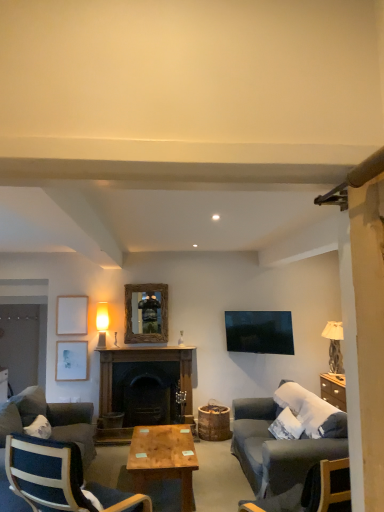
Describe the element at coordinates (102, 322) in the screenshot. I see `matte white lampshade at upper left, the first lamp in the left-to-right sequence` at that location.

Where is `dark gray fabric couch at lower left, acting as the second studio couch starting from the front`? Image resolution: width=384 pixels, height=512 pixels. dark gray fabric couch at lower left, acting as the second studio couch starting from the front is located at coordinates (49, 421).

What is the approximate height of wooden mirror at center, which is the first picture frame from right to left?

wooden mirror at center, which is the first picture frame from right to left, is 32.30 inches tall.

The width and height of the screenshot is (384, 512). What do you see at coordinates (163, 458) in the screenshot? I see `wooden polished coffee table at center` at bounding box center [163, 458].

The height and width of the screenshot is (512, 384). What do you see at coordinates (71, 361) in the screenshot? I see `matte white picture frame at left, which is the 2th picture frame in left-to-right order` at bounding box center [71, 361].

Find the location of `matte white lampshade at upper left, the first lamp in the left-to-right sequence`. matte white lampshade at upper left, the first lamp in the left-to-right sequence is located at coordinates (x=102, y=322).

Considering the relative sizes of white fabric lampshade at right, which is the 1th lamp from right to left, and dark gray fabric couch at lower right, placed as the 1th studio couch when sorted from right to left, in the image provided, is white fabric lampshade at right, which is the 1th lamp from right to left, taller than dark gray fabric couch at lower right, placed as the 1th studio couch when sorted from right to left,?

No, white fabric lampshade at right, which is the 1th lamp from right to left, is not taller than dark gray fabric couch at lower right, placed as the 1th studio couch when sorted from right to left.

Which is more to the right, white fabric lampshade at right, the second lamp in the left-to-right sequence, or dark gray fabric couch at lower right, positioned as the 2th studio couch in back-to-front order?

white fabric lampshade at right, the second lamp in the left-to-right sequence.

Is white fabric lampshade at right, which is the 1th lamp from right to left, placed right next to dark gray fabric couch at lower right, which is counted as the first studio couch, starting from the front?

No, white fabric lampshade at right, which is the 1th lamp from right to left, is not touching dark gray fabric couch at lower right, which is counted as the first studio couch, starting from the front.

Can you confirm if wooden polished coffee table at center is bigger than matte white lampshade at upper left, the first lamp in the left-to-right sequence?

Yes, wooden polished coffee table at center is bigger than matte white lampshade at upper left, the first lamp in the left-to-right sequence.

Is wooden polished coffee table at center not near matte white lampshade at upper left, the first lamp in the left-to-right sequence?

Absolutely, wooden polished coffee table at center is distant from matte white lampshade at upper left, the first lamp in the left-to-right sequence.

From the picture: Who is shorter, wooden polished coffee table at center or matte white lampshade at upper left, the first lamp in the left-to-right sequence?

Standing shorter between the two is wooden polished coffee table at center.

From a real-world perspective, between wooden mirror at center, the third picture frame when ordered from left to right, and dark wood fireplace at center, who is vertically higher?

In real-world perspective, wooden mirror at center, the third picture frame when ordered from left to right, is above.

In the scene shown: From the image's perspective, is wooden mirror at center, which is the first picture frame from right to left, located above or below dark wood fireplace at center?

wooden mirror at center, which is the first picture frame from right to left, is above dark wood fireplace at center.

Between wooden mirror at center, which is the first picture frame from right to left, and dark wood fireplace at center, which one has smaller size?

Smaller between the two is wooden mirror at center, which is the first picture frame from right to left.

Which point is more distant from viewer, (163, 290) or (73, 435)?

Positioned behind is point (163, 290).

Is wooden mirror at center, the third picture frame when ordered from left to right, in contact with dark gray fabric couch at lower left, the first studio couch from the back?

No, wooden mirror at center, the third picture frame when ordered from left to right, is not with dark gray fabric couch at lower left, the first studio couch from the back.

Who is taller, wooden mirror at center, which is the first picture frame from right to left, or dark gray fabric couch at lower left, the first studio couch from the back?

dark gray fabric couch at lower left, the first studio couch from the back, is taller.

Between white matte picture frame at upper left, the 3th picture frame positioned from the right, and dark wood fireplace at center, which one appears on the left side from the viewer's perspective?

From the viewer's perspective, white matte picture frame at upper left, the 3th picture frame positioned from the right, appears more on the left side.

Could you tell me if white matte picture frame at upper left, which ranks as the 1th picture frame in left-to-right order, is turned towards dark wood fireplace at center?

No.

Consider the image. Considering the relative sizes of white matte picture frame at upper left, which ranks as the 1th picture frame in left-to-right order, and dark wood fireplace at center in the image provided, is white matte picture frame at upper left, which ranks as the 1th picture frame in left-to-right order, wider than dark wood fireplace at center?

Incorrect, the width of white matte picture frame at upper left, which ranks as the 1th picture frame in left-to-right order, does not surpass that of dark wood fireplace at center.

From the dark wood fireplace at center, count the 3rd picture frame to the left and point to it. Please provide its 2D coordinates.

[(72, 315)]

Consider the image. How different are the orientations of white fabric lampshade at right, the second lamp in the left-to-right sequence, and matte white lampshade at upper left, the second lamp positioned from the right, in degrees?

The angle between the facing direction of white fabric lampshade at right, the second lamp in the left-to-right sequence, and the facing direction of matte white lampshade at upper left, the second lamp positioned from the right, is 92.9 degrees.

Are white fabric lampshade at right, the second lamp in the left-to-right sequence, and matte white lampshade at upper left, the first lamp in the left-to-right sequence, far apart?

Yes, white fabric lampshade at right, the second lamp in the left-to-right sequence, and matte white lampshade at upper left, the first lamp in the left-to-right sequence, are located far from each other.

Does white fabric lampshade at right, the second lamp in the left-to-right sequence, appear on the right side of matte white lampshade at upper left, the second lamp positioned from the right?

Indeed, white fabric lampshade at right, the second lamp in the left-to-right sequence, is positioned on the right side of matte white lampshade at upper left, the second lamp positioned from the right.

Find the location of a particular element. The width and height of the screenshot is (384, 512). lamp below the matte white lampshade at upper left, the first lamp in the left-to-right sequence (from the image's perspective) is located at coordinates (334, 345).

Where is `the 1st lamp positioned above the wooden polished coffee table at center (from a real-world perspective)`? Image resolution: width=384 pixels, height=512 pixels. the 1st lamp positioned above the wooden polished coffee table at center (from a real-world perspective) is located at coordinates (334, 345).

From a real-world perspective, is white fabric lampshade at right, the second lamp in the left-to-right sequence, positioned above or below wooden polished coffee table at center?

From a real-world perspective, white fabric lampshade at right, the second lamp in the left-to-right sequence, is physically above wooden polished coffee table at center.

Can you confirm if white fabric lampshade at right, the second lamp in the left-to-right sequence, is wider than wooden polished coffee table at center?

No.

Where is `lamp that is the 1st object located above the dark gray fabric couch at lower right, positioned as the 2th studio couch in back-to-front order (from the image's perspective)`? The width and height of the screenshot is (384, 512). lamp that is the 1st object located above the dark gray fabric couch at lower right, positioned as the 2th studio couch in back-to-front order (from the image's perspective) is located at coordinates click(334, 345).

The image size is (384, 512). What are the coordinates of `lamp on the left of wooden polished coffee table at center` in the screenshot? It's located at (102, 322).

Estimate the real-world distances between objects in this image. Which object is closer to wooden mirror at center, which is the first picture frame from right to left, matte white lampshade at upper left, the first lamp in the left-to-right sequence, or white matte picture frame at upper left, which ranks as the 1th picture frame in left-to-right order?

matte white lampshade at upper left, the first lamp in the left-to-right sequence, is closer to wooden mirror at center, which is the first picture frame from right to left.

Estimate the real-world distances between objects in this image. Which object is further from matte white lampshade at upper left, the first lamp in the left-to-right sequence, dark blue fabric chair at lower left or white fabric lampshade at right, which is the 1th lamp from right to left?

white fabric lampshade at right, which is the 1th lamp from right to left, is further to matte white lampshade at upper left, the first lamp in the left-to-right sequence.

From the image, which object appears to be nearer to dark wood fireplace at center, dark gray fabric couch at lower left, placed as the second studio couch when sorted from right to left, or white fabric lampshade at right, the second lamp in the left-to-right sequence?

Among the two, dark gray fabric couch at lower left, placed as the second studio couch when sorted from right to left, is located nearer to dark wood fireplace at center.

Estimate the real-world distances between objects in this image. Which object is closer to dark gray fabric couch at lower right, which is counted as the first studio couch, starting from the front, wooden mirror at center, the third picture frame when ordered from left to right, or dark gray fabric couch at lower left, acting as the second studio couch starting from the front?

dark gray fabric couch at lower left, acting as the second studio couch starting from the front, lies closer to dark gray fabric couch at lower right, which is counted as the first studio couch, starting from the front, than the other object.

When comparing their distances from matte white picture frame at left, which is the second picture frame in right-to-left order, does matte white lampshade at upper left, the second lamp positioned from the right, or white matte picture frame at upper left, which ranks as the 1th picture frame in left-to-right order, seem closer?

white matte picture frame at upper left, which ranks as the 1th picture frame in left-to-right order, is positioned closer to the anchor matte white picture frame at left, which is the second picture frame in right-to-left order.

Considering their positions, is dark blue fabric chair at lower left positioned closer to matte white lampshade at upper left, the second lamp positioned from the right, than dark wood fireplace at center?

Among the two, dark wood fireplace at center is located nearer to matte white lampshade at upper left, the second lamp positioned from the right.

Which object lies nearer to the anchor point wooden mirror at center, the third picture frame when ordered from left to right, dark wood fireplace at center or dark gray fabric couch at lower left, the first studio couch from the back?

Among the two, dark wood fireplace at center is located nearer to wooden mirror at center, the third picture frame when ordered from left to right.

Considering their positions, is wooden mirror at center, the third picture frame when ordered from left to right, positioned closer to dark wood fireplace at center than wooden polished coffee table at center?

wooden mirror at center, the third picture frame when ordered from left to right, is closer to dark wood fireplace at center.

The image size is (384, 512). I want to click on coffee table between dark gray fabric couch at lower right, which appears as the 2th studio couch when viewed from the left, and dark wood fireplace at center, along the z-axis, so click(163, 458).

In order to click on coffee table positioned between dark gray fabric couch at lower right, which appears as the 2th studio couch when viewed from the left, and white fabric lampshade at right, which is the 1th lamp from right to left, from near to far in this screenshot , I will do `click(163, 458)`.

What are the coordinates of `picture frame between matte white picture frame at left, which is the 2th picture frame in left-to-right order, and dark wood fireplace at center from left to right` in the screenshot? It's located at (146, 313).

Image resolution: width=384 pixels, height=512 pixels. Find the location of `fireplace between wooden mirror at center, which is the first picture frame from right to left, and white fabric lampshade at right, the second lamp in the left-to-right sequence`. fireplace between wooden mirror at center, which is the first picture frame from right to left, and white fabric lampshade at right, the second lamp in the left-to-right sequence is located at coordinates (144, 360).